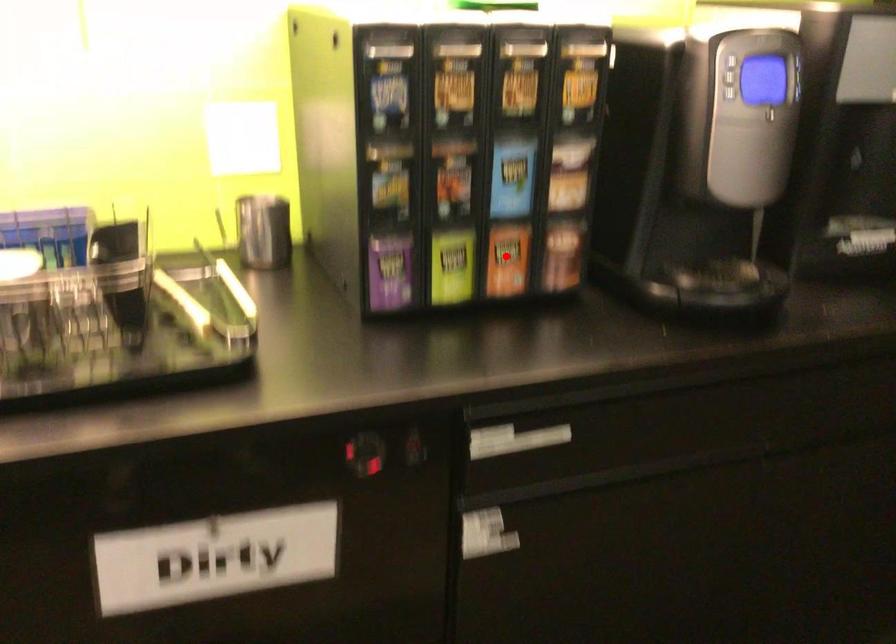
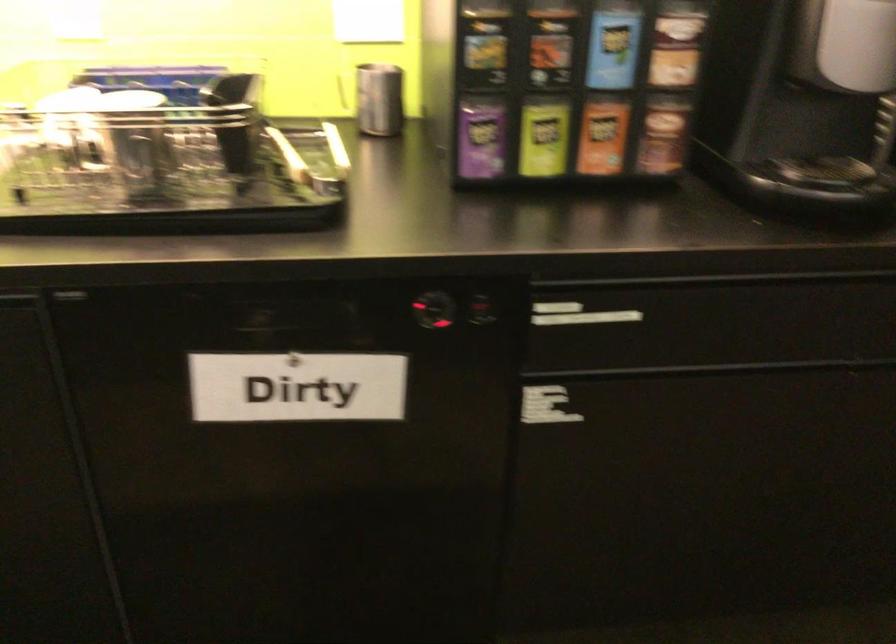
Where in the second image is the point corresponding to the highlighted location from the first image?

(602, 136)